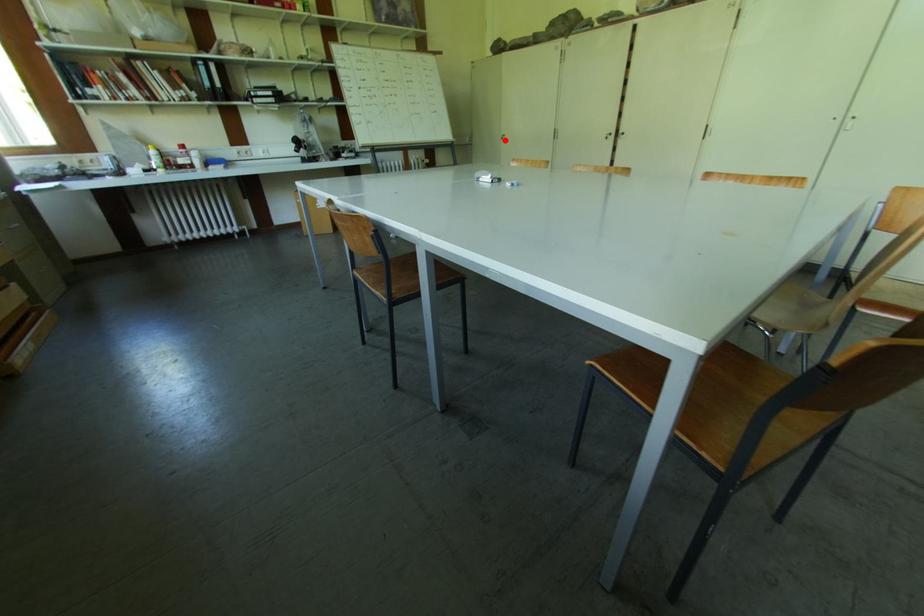
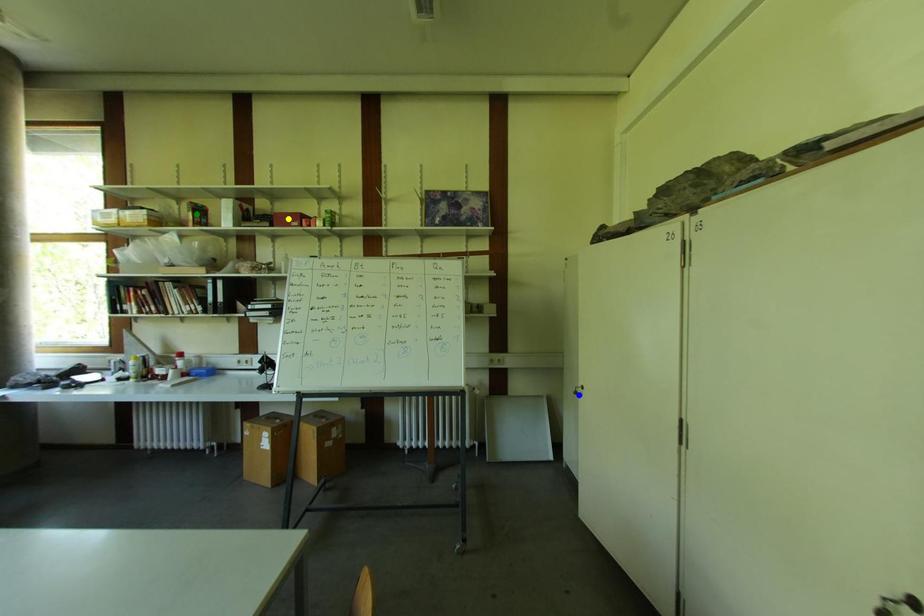
Question: I am providing you with two images of the same scene from different viewpoints. A red point is marked on the first image. You are given multiple points on the second image. Which point in image 2 is actually the same real-world point as the red point in image 1?

Choices:
 (A) green point
 (B) blue point
 (C) yellow point

Answer: (B)